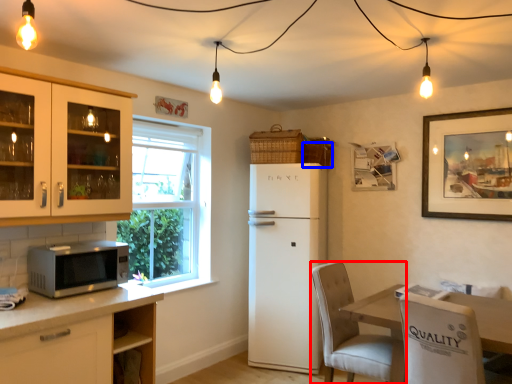
Question: Which object is further to the camera taking this photo, chair (highlighted by a red box) or basket (highlighted by a blue box)?

Choices:
 (A) chair
 (B) basket

Answer: (B)